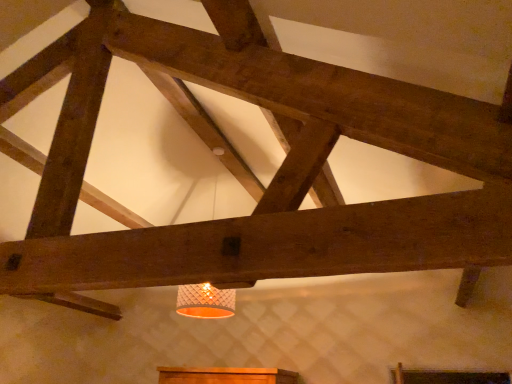
This screenshot has width=512, height=384. What do you see at coordinates (205, 301) in the screenshot?
I see `white textured lampshade at center` at bounding box center [205, 301].

The height and width of the screenshot is (384, 512). What are the coordinates of `white textured lampshade at center` in the screenshot? It's located at (205, 301).

Locate an element on the screen. white textured lampshade at center is located at coordinates (205, 301).